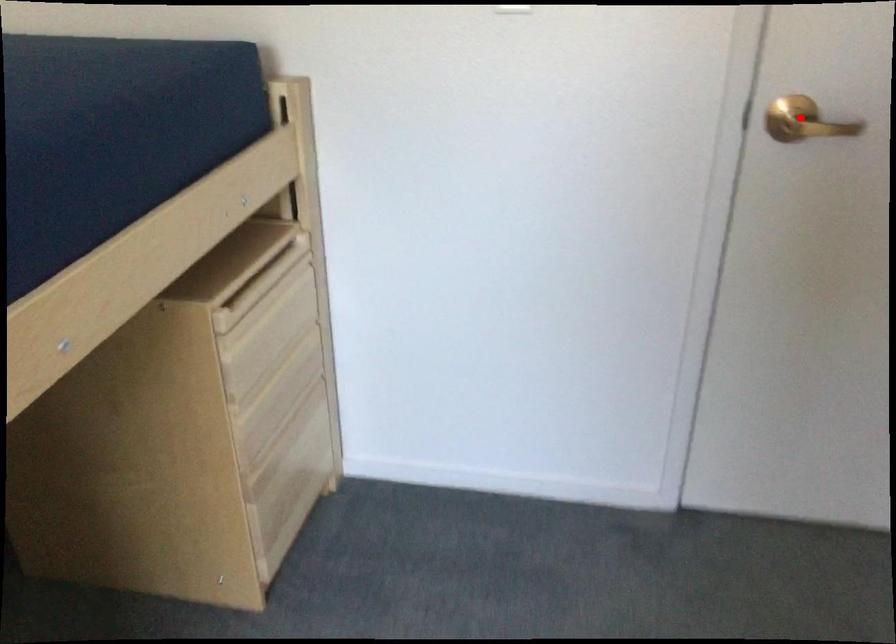
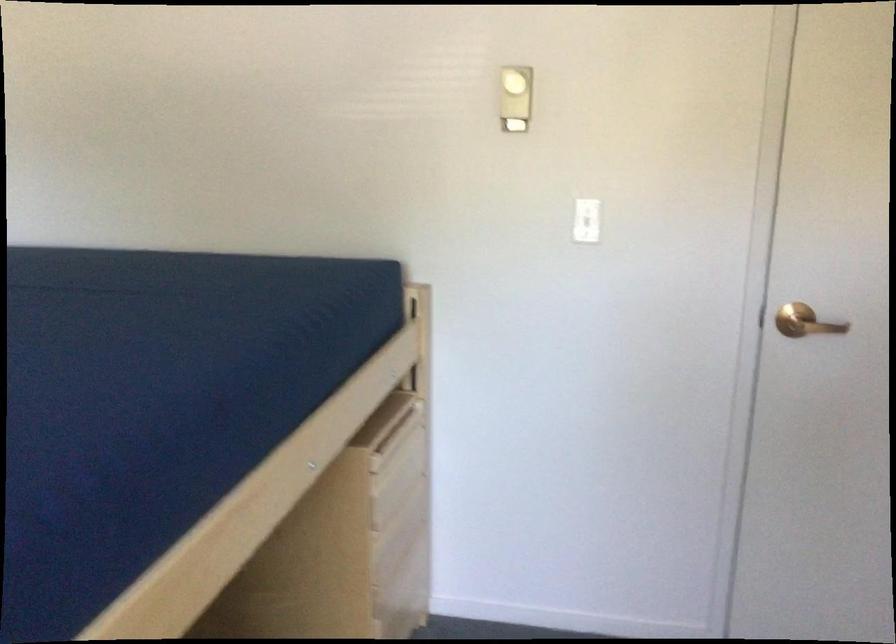
Question: I am providing you with two images of the same scene from different viewpoints. Given a red point in image1, look at the same physical point in image2. Is it:

Choices:
 (A) Closer to the viewpoint
 (B) Farther from the viewpoint

Answer: (B)